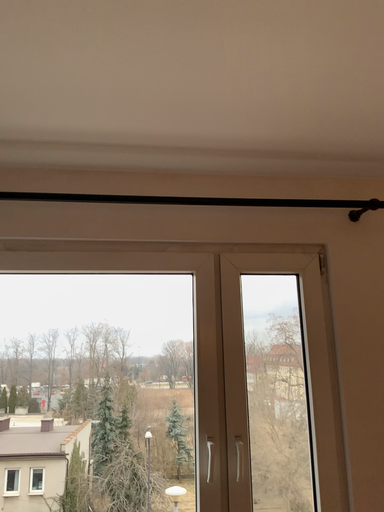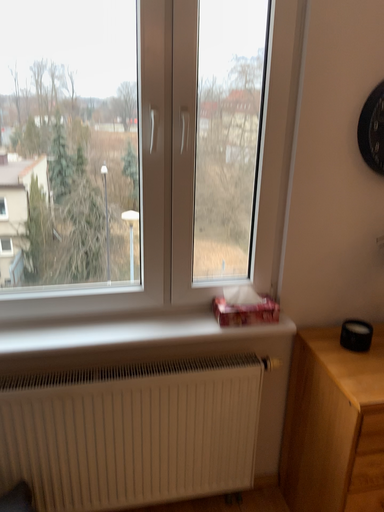
Question: Which way did the camera rotate in the video?

Choices:
 (A) rotated downward
 (B) rotated upward

Answer: (A)